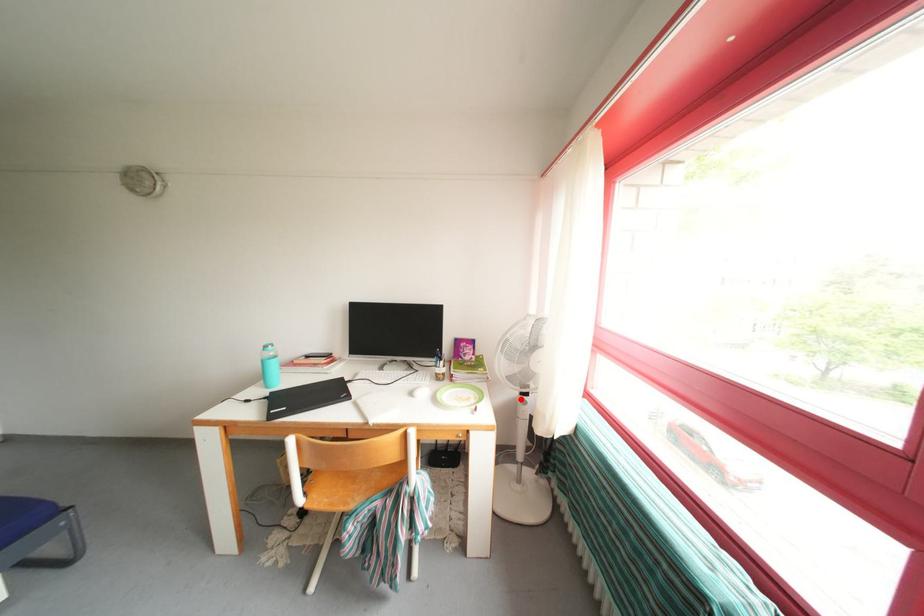
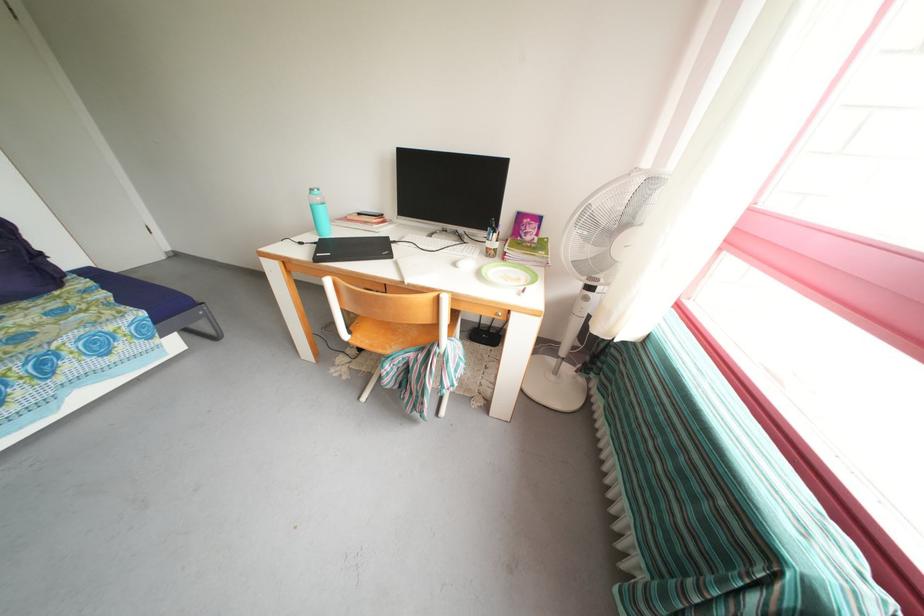
Question: I am providing you with two images of the same scene from different viewpoints. In image1, a red point is highlighted. Considering the same 3D point in image2, which of the following is correct?

Choices:
 (A) It is closer
 (B) It is farther

Answer: (A)